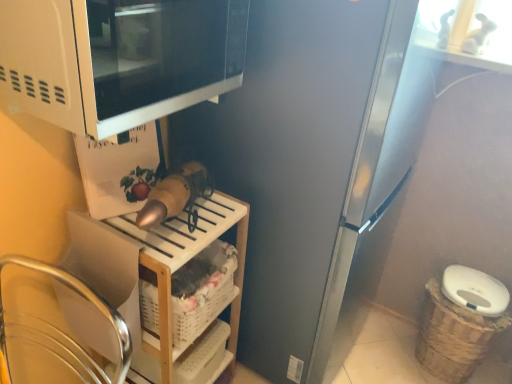
This screenshot has width=512, height=384. What do you see at coordinates (300, 162) in the screenshot?
I see `satin silver refrigerator at center` at bounding box center [300, 162].

What is the approximate height of white woven basket at lower center, placed as the second basket when sorted from back to front?

It is 7.40 inches.

What do you see at coordinates (205, 295) in the screenshot? I see `white woven basket at lower center, placed as the second basket when sorted from back to front` at bounding box center [205, 295].

Where is `satin silver refrigerator at center`? The width and height of the screenshot is (512, 384). satin silver refrigerator at center is located at coordinates (300, 162).

From the image's perspective, is woven brown basket at lower right, placed as the 1th basket when sorted from right to left, on white plastic shelf at lower center?

No, from the image's perspective, woven brown basket at lower right, placed as the 1th basket when sorted from right to left, is not above white plastic shelf at lower center.

Consider the image. Which is further, (441, 326) or (159, 261)?

The point (441, 326) is farther.

At what (x,y) coordinates should I click in order to perform the action: click on shelf above the woven brown basket at lower right, the second basket from the left (from the image's perspective). Please return your answer as a coordinate pair (x, y). This screenshot has height=384, width=512. Looking at the image, I should click on (157, 275).

Is satin silver refrigerator at center touching woven brown basket at lower right, which is the second basket from front to back?

No.

From the image's perspective, is satin silver refrigerator at center on woven brown basket at lower right, which ranks as the 1th basket in back-to-front order?

Yes, from the image's perspective, satin silver refrigerator at center is on top of woven brown basket at lower right, which ranks as the 1th basket in back-to-front order.

Considering the relative sizes of satin silver refrigerator at center and woven brown basket at lower right, placed as the 1th basket when sorted from right to left, in the image provided, is satin silver refrigerator at center thinner than woven brown basket at lower right, placed as the 1th basket when sorted from right to left,?

Incorrect, the width of satin silver refrigerator at center is not less than that of woven brown basket at lower right, placed as the 1th basket when sorted from right to left.

Between satin silver refrigerator at center and woven brown basket at lower right, which ranks as the 1th basket in back-to-front order, which one has more height?

With more height is satin silver refrigerator at center.

Considering the points (179, 316) and (306, 166), which point is in front, point (179, 316) or point (306, 166)?

Point (179, 316)

Is white woven basket at lower center, placed as the second basket when sorted from back to front, wider than satin silver refrigerator at center?

No.

This screenshot has height=384, width=512. Find the location of `the 1st basket located beneath the satin silver refrigerator at center (from a real-world perspective)`. the 1st basket located beneath the satin silver refrigerator at center (from a real-world perspective) is located at coordinates (205, 295).

Between white woven basket at lower center, which is counted as the 1th basket, starting from the left, and satin silver refrigerator at center, which one is positioned behind?

white woven basket at lower center, which is counted as the 1th basket, starting from the left, is behind.

Is white matte microwave at upper left aimed at woven brown basket at lower right, which is the second basket from front to back?

No, white matte microwave at upper left is not oriented towards woven brown basket at lower right, which is the second basket from front to back.

Is white matte microwave at upper left outside of woven brown basket at lower right, the second basket from the left?

white matte microwave at upper left lies outside woven brown basket at lower right, the second basket from the left,'s area.

Locate an element on the screen. The width and height of the screenshot is (512, 384). microwave oven positioned vertically above the woven brown basket at lower right, the second basket from the left (from a real-world perspective) is located at coordinates tap(118, 58).

Is white matte microwave at upper left next to woven brown basket at lower right, which is the second basket from front to back?

No.

Is white woven basket at lower center, which appears as the 2th basket when viewed from the right, smaller than white plastic shelf at lower center?

Correct, white woven basket at lower center, which appears as the 2th basket when viewed from the right, occupies less space than white plastic shelf at lower center.

Does white woven basket at lower center, which is counted as the 1th basket, starting from the left, appear on the left side of white plastic shelf at lower center?

No.

Is white woven basket at lower center, the first basket in the front-to-back sequence, touching white plastic shelf at lower center?

No, white woven basket at lower center, the first basket in the front-to-back sequence, is not beside white plastic shelf at lower center.

Is white woven basket at lower center, which appears as the 2th basket when viewed from the right, in front of or behind white matte microwave at upper left in the image?

Clearly, white woven basket at lower center, which appears as the 2th basket when viewed from the right, is behind white matte microwave at upper left.

Who is bigger, white woven basket at lower center, the first basket in the front-to-back sequence, or white matte microwave at upper left?

With larger size is white matte microwave at upper left.

Considering the sizes of objects white plastic shelf at lower center and satin silver refrigerator at center in the image provided, who is wider, white plastic shelf at lower center or satin silver refrigerator at center?

Wider between the two is satin silver refrigerator at center.

From the picture: Is white plastic shelf at lower center facing away from satin silver refrigerator at center?

That's not correct — white plastic shelf at lower center is not looking away from satin silver refrigerator at center.

Considering the relative positions of white plastic shelf at lower center and satin silver refrigerator at center in the image provided, is white plastic shelf at lower center in front of satin silver refrigerator at center?

That is False.

From the image's perspective, is white plastic shelf at lower center above or below satin silver refrigerator at center?

From the image's perspective, white plastic shelf at lower center appears below satin silver refrigerator at center.

The image size is (512, 384). In the image, there is a woven brown basket at lower right, placed as the 1th basket when sorted from right to left. What are the coordinates of `shelf above it (from the image's perspective)` in the screenshot? It's located at (157, 275).

Starting from the satin silver refrigerator at center, which basket is the 2nd one behind? Please provide its 2D coordinates.

[(454, 336)]

Which object lies further to the anchor point white plastic shelf at lower center, white matte microwave at upper left or satin silver refrigerator at center?

The object further to white plastic shelf at lower center is white matte microwave at upper left.

Based on their spatial positions, is satin silver refrigerator at center or white woven basket at lower center, the first basket in the front-to-back sequence, closer to woven brown basket at lower right, which ranks as the 1th basket in back-to-front order?

Based on the image, satin silver refrigerator at center appears to be nearer to woven brown basket at lower right, which ranks as the 1th basket in back-to-front order.

Which object lies further to the anchor point white matte microwave at upper left, woven brown basket at lower right, which ranks as the 1th basket in back-to-front order, or satin silver refrigerator at center?

woven brown basket at lower right, which ranks as the 1th basket in back-to-front order, lies further to white matte microwave at upper left than the other object.

Looking at the image, which one is located further to satin silver refrigerator at center, white plastic shelf at lower center or white matte microwave at upper left?

white matte microwave at upper left is further to satin silver refrigerator at center.

Considering their positions, is white woven basket at lower center, which appears as the 2th basket when viewed from the right, positioned closer to white matte microwave at upper left than woven brown basket at lower right, which ranks as the 1th basket in back-to-front order?

white woven basket at lower center, which appears as the 2th basket when viewed from the right, lies closer to white matte microwave at upper left than the other object.

From the image, which object appears to be farther from woven brown basket at lower right, the second basket from the left, satin silver refrigerator at center or white matte microwave at upper left?

The object further to woven brown basket at lower right, the second basket from the left, is white matte microwave at upper left.

Based on the photo, estimate the real-world distances between objects in this image. Which object is further from satin silver refrigerator at center, white woven basket at lower center, the first basket in the front-to-back sequence, or woven brown basket at lower right, placed as the 1th basket when sorted from right to left?

The object further to satin silver refrigerator at center is woven brown basket at lower right, placed as the 1th basket when sorted from right to left.

Looking at the image, which one is located closer to woven brown basket at lower right, which ranks as the 1th basket in back-to-front order, white matte microwave at upper left or white plastic shelf at lower center?

The object closer to woven brown basket at lower right, which ranks as the 1th basket in back-to-front order, is white plastic shelf at lower center.

Find the location of a particular element. basket situated between white plastic shelf at lower center and woven brown basket at lower right, the second basket from the left, from left to right is located at coordinates (205, 295).

I want to click on appliance between white matte microwave at upper left and woven brown basket at lower right, which is the second basket from front to back, from left to right, so click(x=300, y=162).

Identify the location of basket situated between white matte microwave at upper left and woven brown basket at lower right, which ranks as the 1th basket in back-to-front order, from left to right. tap(205, 295).

Find the location of a particular element. This screenshot has height=384, width=512. appliance between white matte microwave at upper left and white plastic shelf at lower center in the vertical direction is located at coordinates (300, 162).